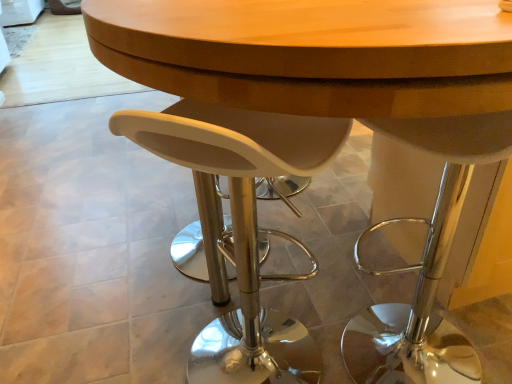
What are the coordinates of `free space to the back side of white plastic stool at center` in the screenshot? It's located at (258, 290).